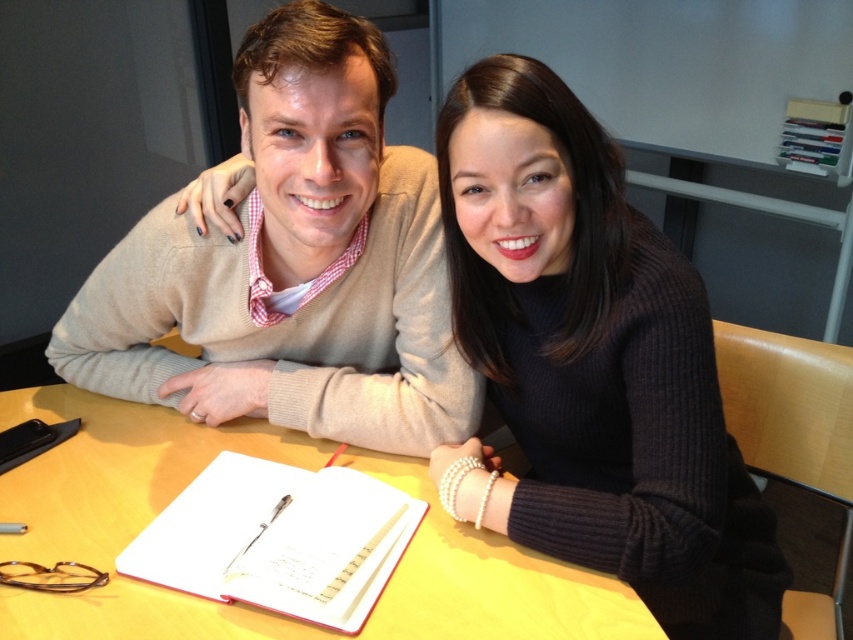
Is black ribbed sweater at center in front of beige sweater at upper left?

Yes, black ribbed sweater at center is in front of beige sweater at upper left.

Between point (717, 445) and point (395, 179), which one is positioned in front?

Point (717, 445) is in front.

In order to click on black ribbed sweater at center in this screenshot , I will do `click(592, 364)`.

Which is more to the left, beige sweater at upper left or red matte notebook at center?

From the viewer's perspective, red matte notebook at center appears more on the left side.

Does beige sweater at upper left have a larger size compared to red matte notebook at center?

Correct, beige sweater at upper left is larger in size than red matte notebook at center.

Between point (384, 67) and point (265, 506), which one is positioned in front?

Point (384, 67)

You are a GUI agent. You are given a task and a screenshot of the screen. Output one action in this format:
    pyautogui.click(x=<x>, y=<y>)
    Task: Click on the beige sweater at upper left
    Image resolution: width=853 pixels, height=640 pixels.
    Given the screenshot: What is the action you would take?
    pyautogui.click(x=293, y=266)

Is yellow matte table at center shorter than red matte notebook at center?

No, yellow matte table at center is not shorter than red matte notebook at center.

Is point (477, 636) in front of point (335, 627)?

That is True.

Which is behind, point (28, 499) or point (309, 609)?

Point (28, 499)

Find the location of a particular element. The width and height of the screenshot is (853, 640). yellow matte table at center is located at coordinates tap(123, 516).